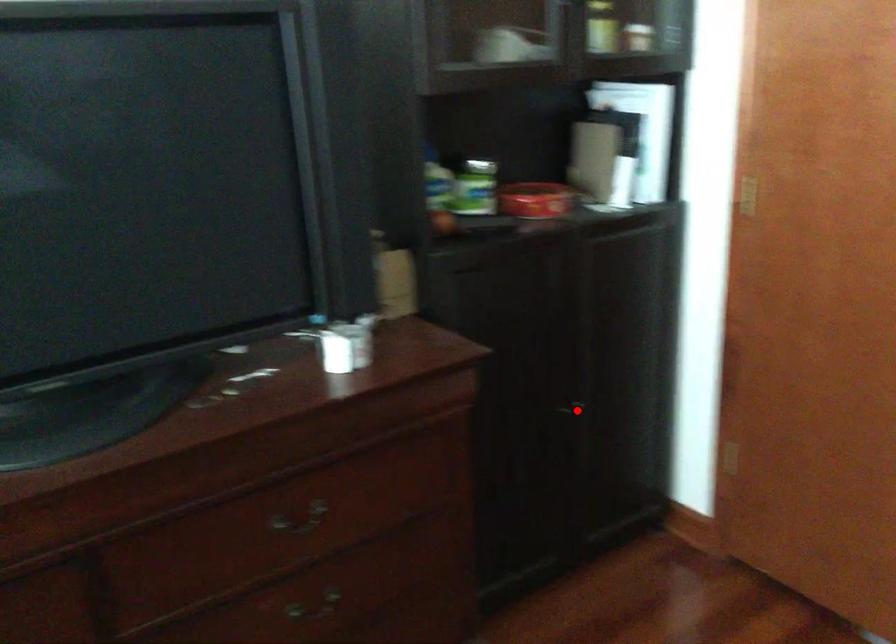
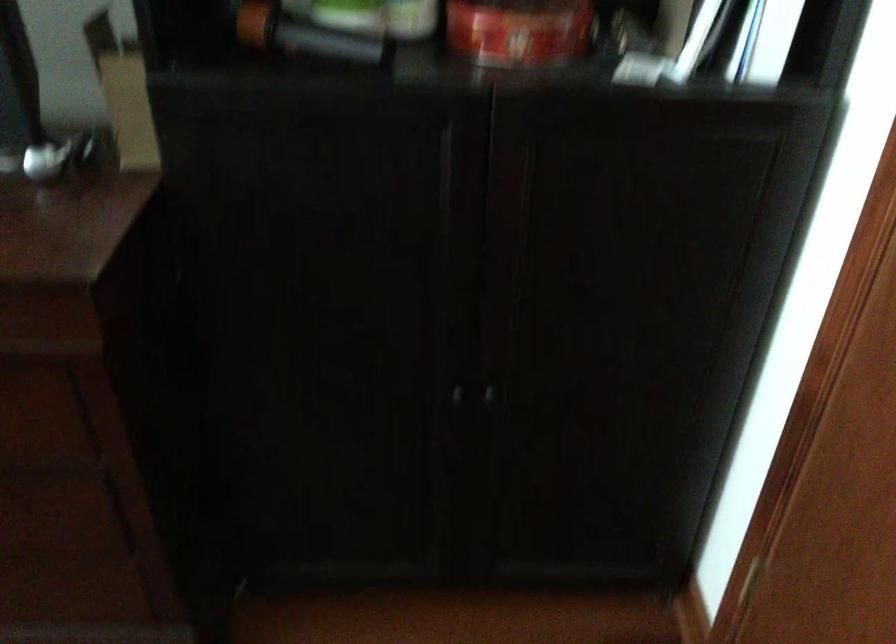
Question: I am providing you with two images of the same scene from different viewpoints. Image1 has a red point marked. In image2, the corresponding 3D location appears at what relative position? Reply with the corresponding letter.

Choices:
 (A) Closer
 (B) Farther

Answer: (A)